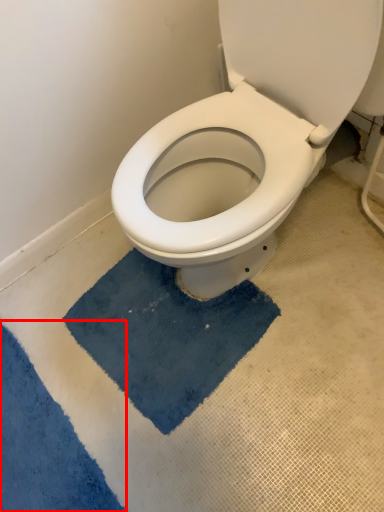
Question: From the image's perspective, what is the correct spatial relationship of bath mat (annotated by the red box) in relation to bath mat?

Choices:
 (A) above
 (B) below

Answer: (B)